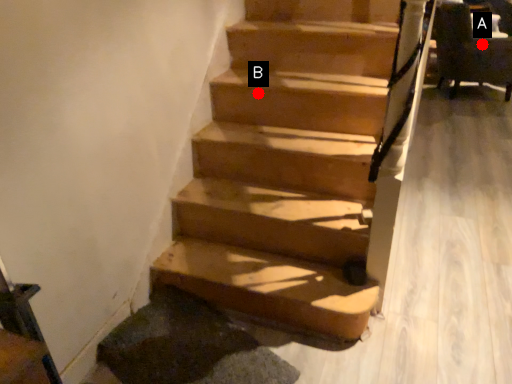
Question: Two points are circled on the image, labeled by A and B beside each circle. Which point is further to the camera?

Choices:
 (A) A is further
 (B) B is further

Answer: (A)